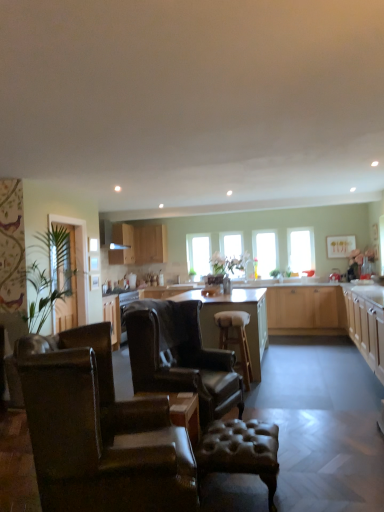
Question: Is light brown wood countertop at center not close to clear glass door at left?

Choices:
 (A) no
 (B) yes

Answer: (B)

Question: Is light brown wood countertop at center smaller than clear glass door at left?

Choices:
 (A) no
 (B) yes

Answer: (A)

Question: From a real-world perspective, does light brown wood countertop at center sit lower than clear glass door at left?

Choices:
 (A) no
 (B) yes

Answer: (B)

Question: Does light brown wood countertop at center turn towards clear glass door at left?

Choices:
 (A) no
 (B) yes

Answer: (A)

Question: Can you confirm if light brown wood countertop at center is taller than clear glass door at left?

Choices:
 (A) yes
 (B) no

Answer: (B)

Question: From the image's perspective, is light brown wood countertop at center over clear glass door at left?

Choices:
 (A) yes
 (B) no

Answer: (B)

Question: From a real-world perspective, is leather tufted bar stool at center, the second bar stool positioned from the back, beneath light wood cabinet at upper center, marked as the third cabinetry in a front-to-back arrangement?

Choices:
 (A) yes
 (B) no

Answer: (A)

Question: From the image's perspective, is leather tufted bar stool at center, the 1th bar stool positioned from the front, above light wood cabinet at upper center, which is the first cabinetry in back-to-front order?

Choices:
 (A) yes
 (B) no

Answer: (B)

Question: From the image's perspective, is leather tufted bar stool at center, the 1th bar stool positioned from the front, beneath light wood cabinet at upper center, which is the 1th cabinetry from left to right?

Choices:
 (A) no
 (B) yes

Answer: (B)

Question: Is leather tufted bar stool at center, the 1th bar stool positioned from the front, further to the viewer compared to light wood cabinet at upper center, marked as the third cabinetry in a front-to-back arrangement?

Choices:
 (A) yes
 (B) no

Answer: (B)

Question: Can light wood cabinet at upper center, marked as the third cabinetry in a front-to-back arrangement, be found inside leather tufted bar stool at center, the second bar stool positioned from the back?

Choices:
 (A) yes
 (B) no

Answer: (B)

Question: Is leather tufted bar stool at center, the 1th bar stool positioned from the front, at the left side of light wood cabinet at upper center, arranged as the 3th cabinetry when viewed from the right?

Choices:
 (A) no
 (B) yes

Answer: (A)

Question: Is leather wingback chair at center, arranged as the first chair when viewed from the back, further to the viewer compared to clear glass door at left?

Choices:
 (A) no
 (B) yes

Answer: (A)